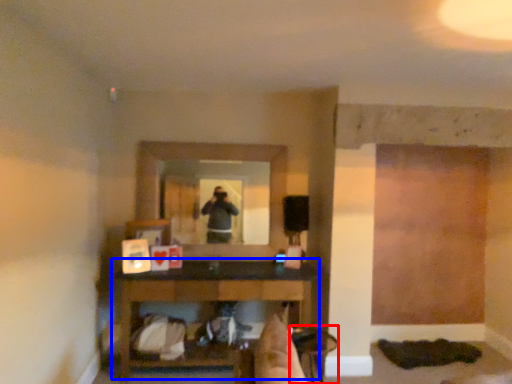
Question: Which object appears farthest to the camera in this image, chair (highlighted by a red box) or table (highlighted by a blue box)?

Choices:
 (A) chair
 (B) table

Answer: (B)